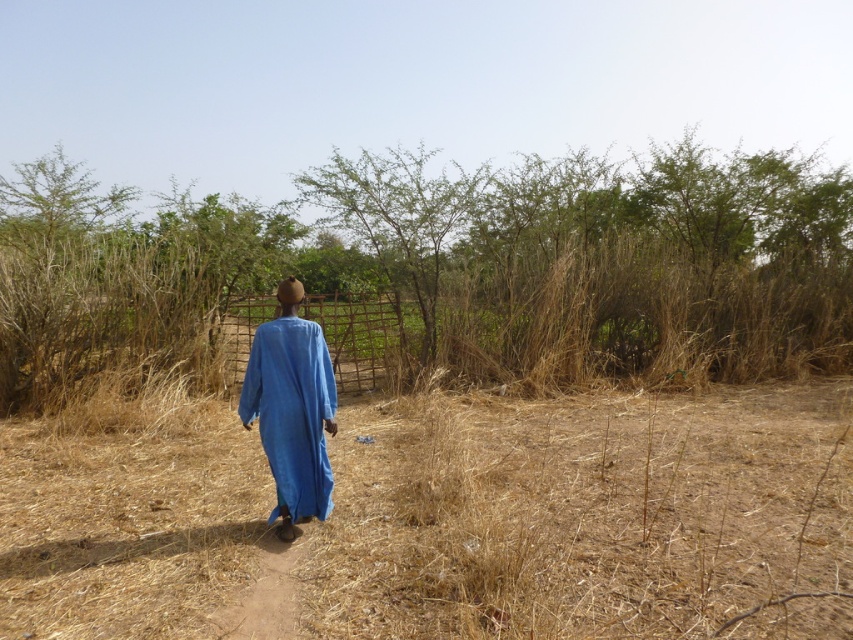
You are a photographer trying to capture the blue cotton robe at center and the brown dry bush at center in the same frame. Based on their sizes, which object will appear larger in the photo?

The brown dry bush at center is bigger than the blue cotton robe at center, so it will appear larger in the photo.

You are a drone operator trying to capture a photo of the brown dry bush at center. The drone is currently positioned directly above the person walking along the dirt path. To ensure the bush is in the frame, in which direction should you move the drone horizontally?

The brown dry bush at center is located at point (x=444, y=268), so you should move the drone to the left and slightly forward to align with the coordinates of the brown dry bush at center.

You are standing at the camera position observing the scene. The brown dry bush at center is an obstacle. Can you walk straight ahead without stepping on it?

The brown dry bush at center is located at point [444,268], which is directly in front of you. Therefore, walking straight ahead would require stepping on it. You should adjust your path to avoid it.